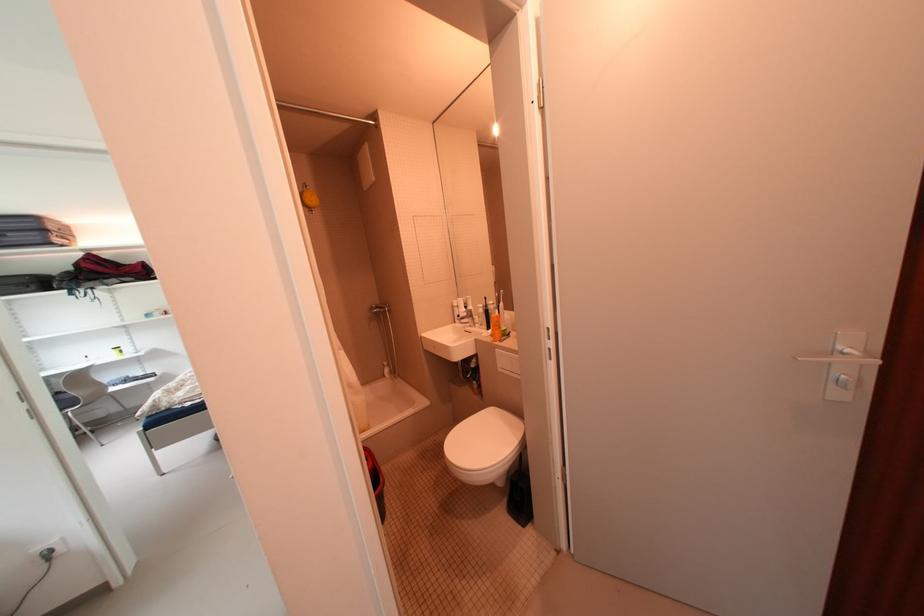
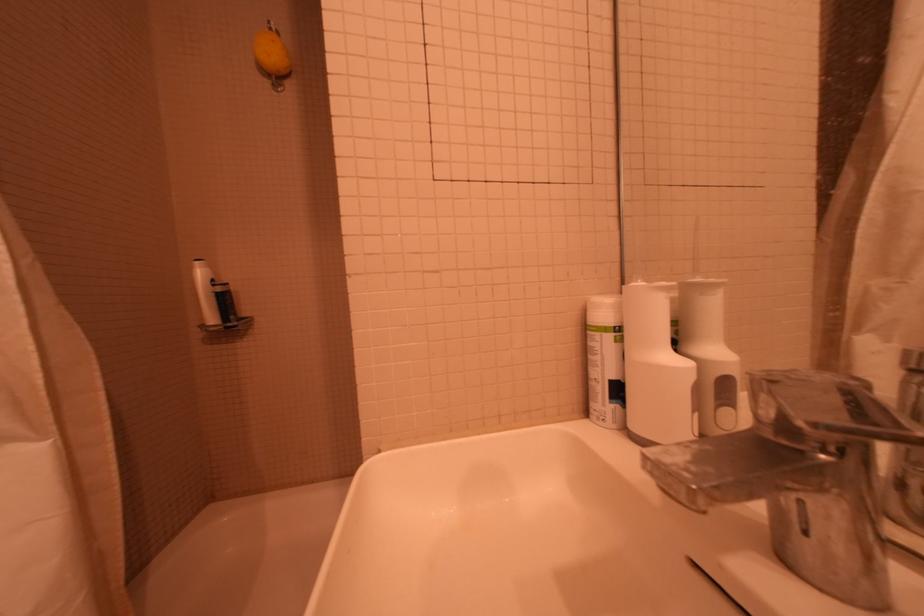
In the second image, find the point that corresponds to (x=466, y=304) in the first image.

(627, 309)